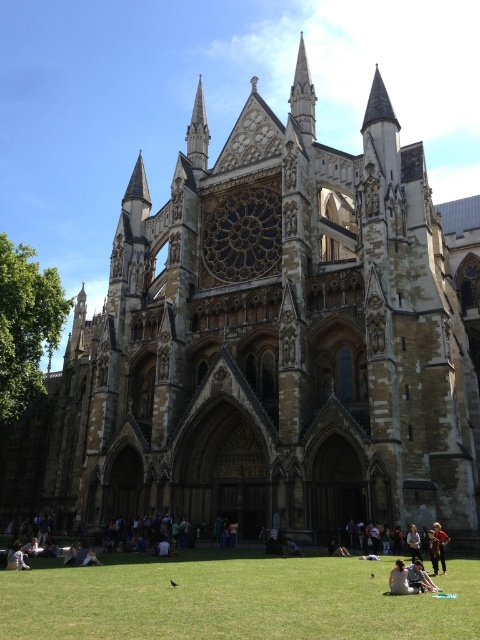
You are standing in front of Westminster Abbey and notice a light brown leather jacket at lower center and blue denim jeans at center. Which object is taller?

The light brown leather jacket at lower center is much taller than the blue denim jeans at center.